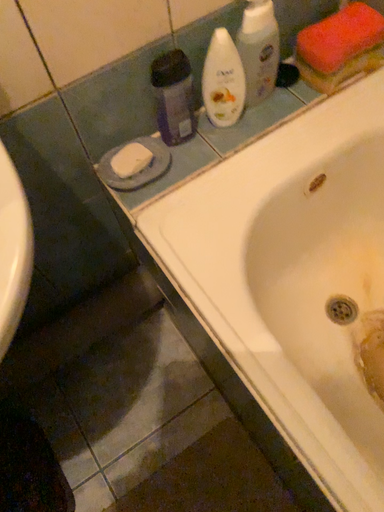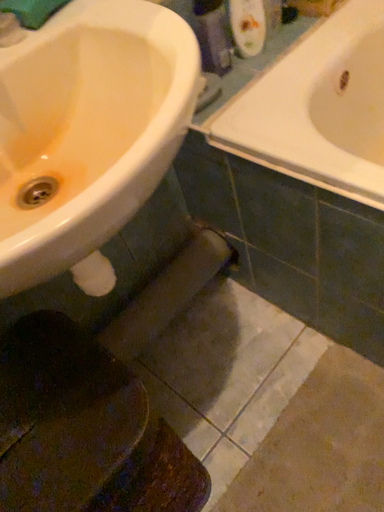
Question: Which way did the camera rotate in the video?

Choices:
 (A) rotated downward
 (B) rotated upward

Answer: (B)